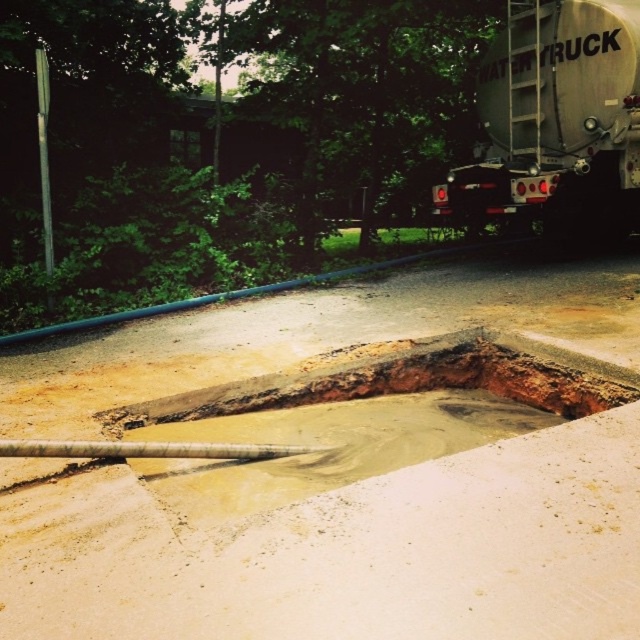
Question: Is smooth concrete at center to the right of silver metallic trailer truck at upper right from the viewer's perspective?

Choices:
 (A) yes
 (B) no

Answer: (B)

Question: Is smooth concrete at center smaller than silver metallic trailer truck at upper right?

Choices:
 (A) no
 (B) yes

Answer: (B)

Question: Which point appears closest to the camera in this image?

Choices:
 (A) (595, 454)
 (B) (605, 16)
 (C) (282, 378)

Answer: (A)

Question: Considering the real-world distances, which object is farthest from the muddy concrete puddle at center?

Choices:
 (A) silver metallic trailer truck at upper right
 (B) smooth concrete at center

Answer: (A)

Question: Among these objects, which one is nearest to the camera?

Choices:
 (A) silver metallic trailer truck at upper right
 (B) muddy concrete puddle at center

Answer: (B)

Question: Does smooth concrete at center appear over muddy concrete puddle at center?

Choices:
 (A) yes
 (B) no

Answer: (B)